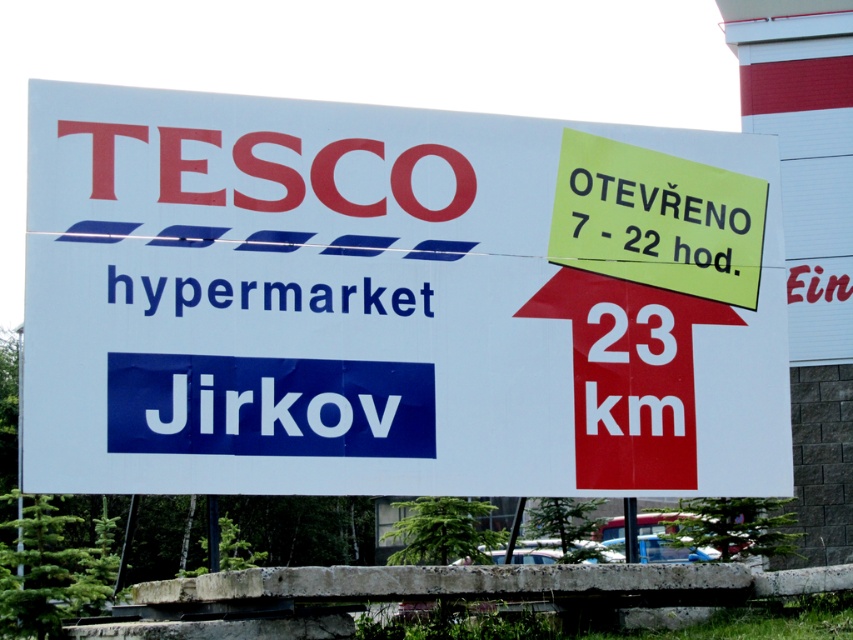
You are standing in front of the Tesco hypermarket sign in Jirkov. You notice two points marked on the sign. Which point, point at (625, 458) or point at (622, 218), is closer to you?

Point at (625, 458) is closer to the viewer than point at (622, 218).

You are standing in front of the Tesco hypermarket sign in Jirkov. You see the white paper sign at center and the yellow paper sign at upper right. Which one appears nearer to you?

The white paper sign at center is closer to the viewer than the yellow paper sign at upper right, so the white paper sign at center appears nearer.